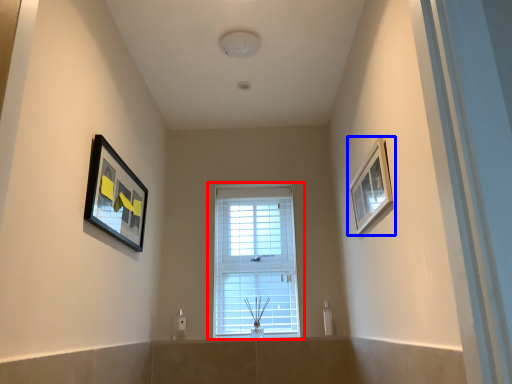
Question: Which object is further to the camera taking this photo, window (highlighted by a red box) or picture frame (highlighted by a blue box)?

Choices:
 (A) window
 (B) picture frame

Answer: (A)